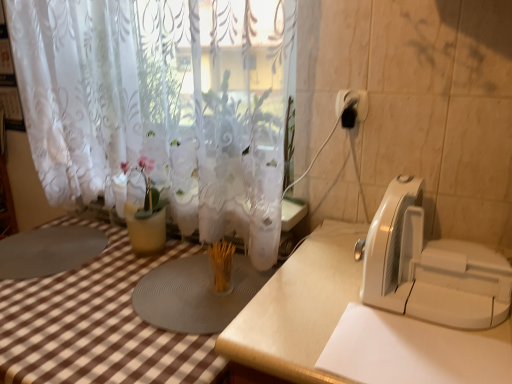
At what (x,y) coordinates should I click in order to perform the action: click on vacant space situated above white matte table at center (from a real-world perspective). Please return your answer as a coordinate pair (x, y). Looking at the image, I should click on (365, 312).